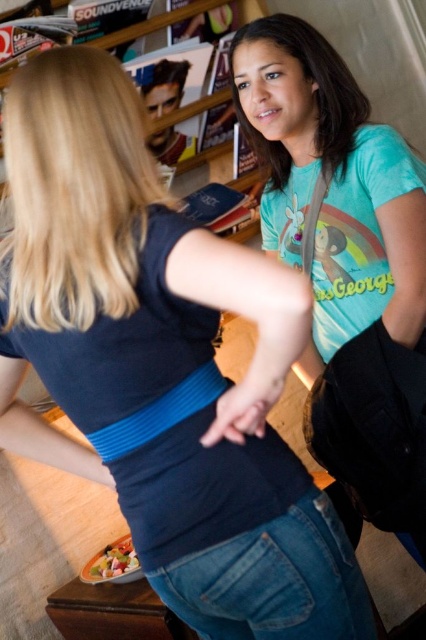
At what (x,y) coordinates should I click in order to perform the action: click on teal matte t-shirt at center. Please return your answer as a coordinate pair (x, y). Looking at the image, I should click on (331, 186).

Which is more to the left, teal matte t-shirt at center or smooth plastic container at lower left?

Positioned to the left is smooth plastic container at lower left.

Does point (284, 241) come closer to viewer compared to point (124, 566)?

Yes.

Locate an element on the screen. This screenshot has height=640, width=426. teal matte t-shirt at center is located at coordinates (331, 186).

Can you confirm if teal matte t-shirt at center is wider than wooden bookshelf at upper center?

Incorrect, teal matte t-shirt at center's width does not surpass wooden bookshelf at upper center's.

Who is higher up, teal matte t-shirt at center or wooden bookshelf at upper center?

wooden bookshelf at upper center is higher up.

Where is `teal matte t-shirt at center`? teal matte t-shirt at center is located at coordinates (331, 186).

Does wooden bookshelf at upper center appear on the right side of smooth plastic container at lower left?

Indeed, wooden bookshelf at upper center is positioned on the right side of smooth plastic container at lower left.

Between wooden bookshelf at upper center and smooth plastic container at lower left, which one is positioned higher?

wooden bookshelf at upper center

Who is more distant from viewer, (138, 35) or (106, 570)?

The point (138, 35) is more distant.

Image resolution: width=426 pixels, height=640 pixels. Find the location of `wooden bookshelf at upper center`. wooden bookshelf at upper center is located at coordinates (181, 19).